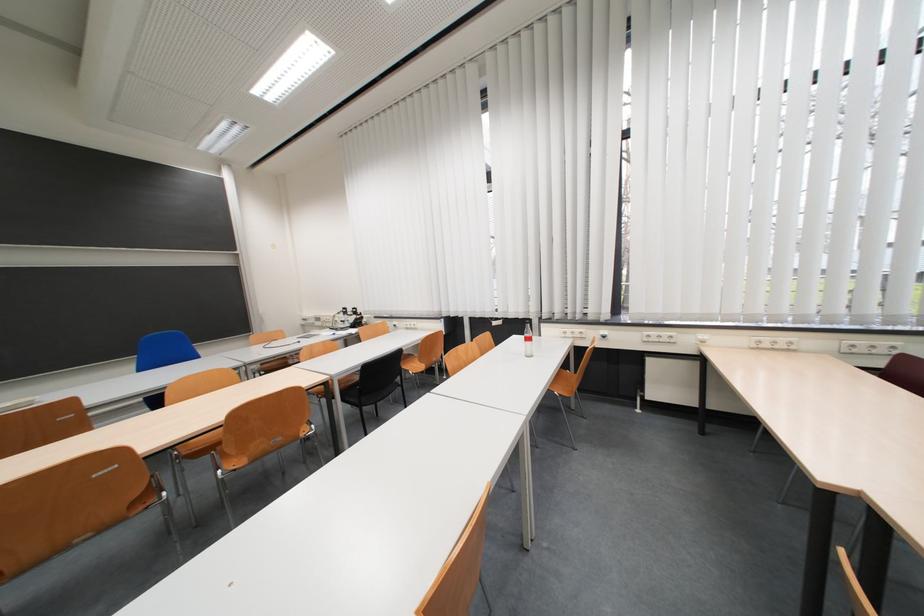
What do you see at coordinates (154, 400) in the screenshot? The image size is (924, 616). I see `the blue chair sitting surface` at bounding box center [154, 400].